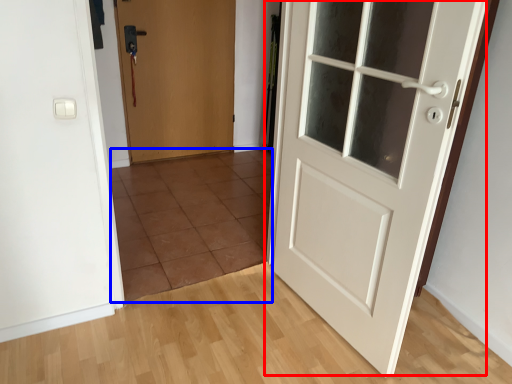
Question: Among these objects, which one is farthest to the camera, door (highlighted by a red box) or tile (highlighted by a blue box)?

Choices:
 (A) door
 (B) tile

Answer: (B)